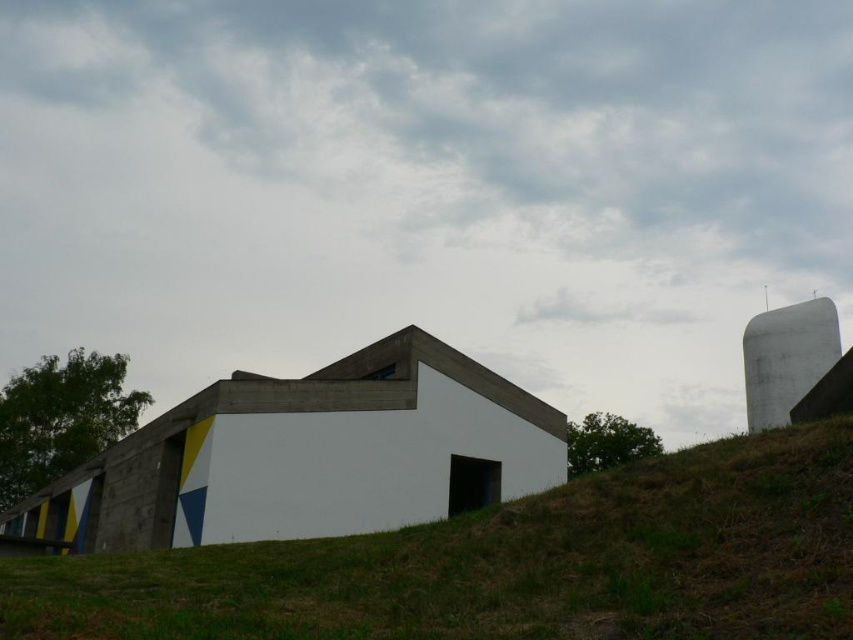
Does green grassy hillside at lower center have a greater height compared to white smooth silo at right?

No.

Based on the photo, between green grassy hillside at lower center and white smooth silo at right, which one is positioned lower?

green grassy hillside at lower center

Where is `green grassy hillside at lower center`? The height and width of the screenshot is (640, 853). green grassy hillside at lower center is located at coordinates (509, 563).